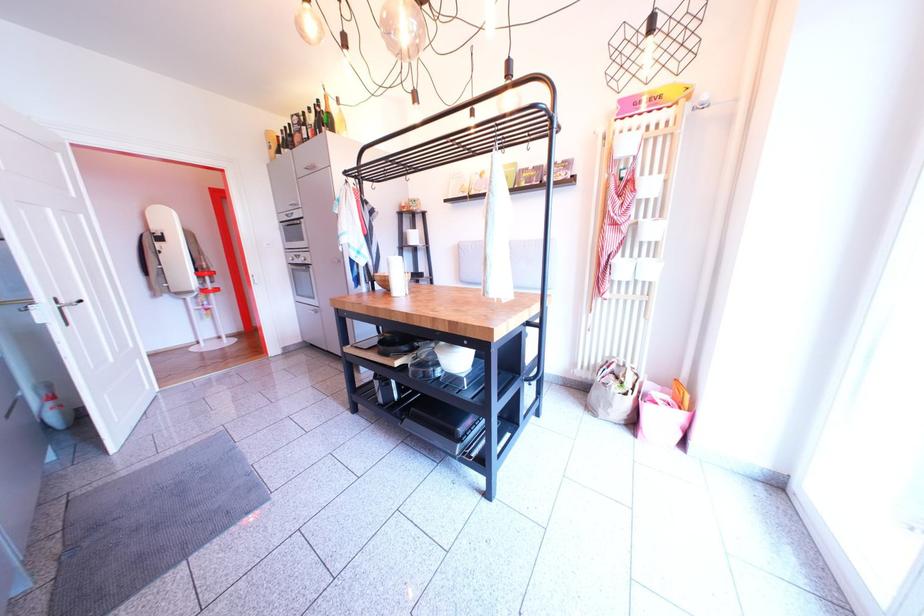
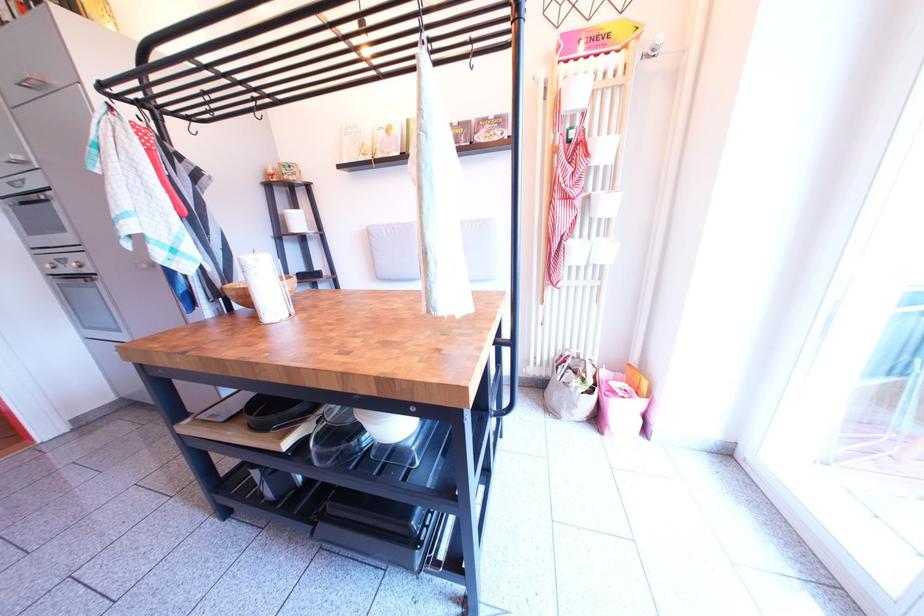
Where in the second image is the point corresponding to the point at 622,411 from the first image?

(586, 411)